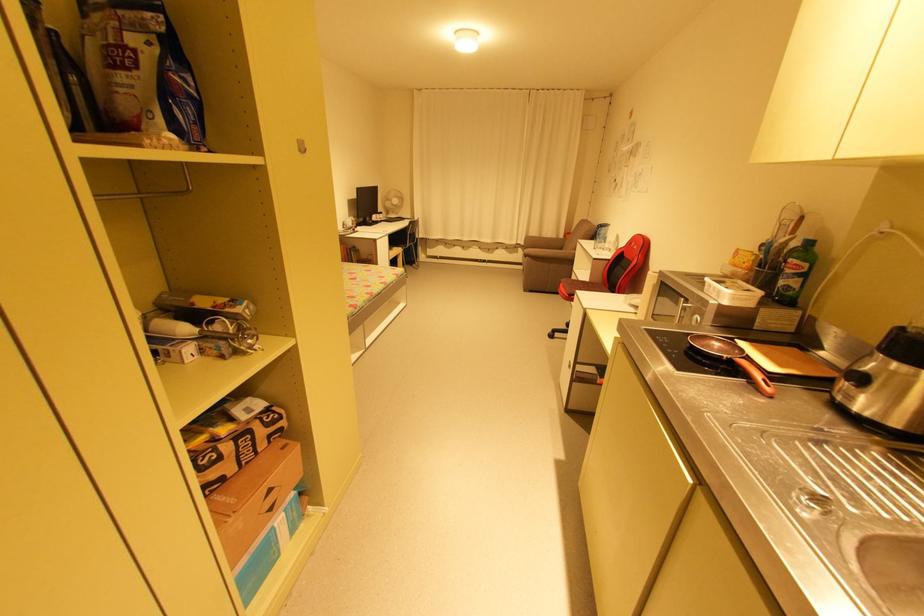
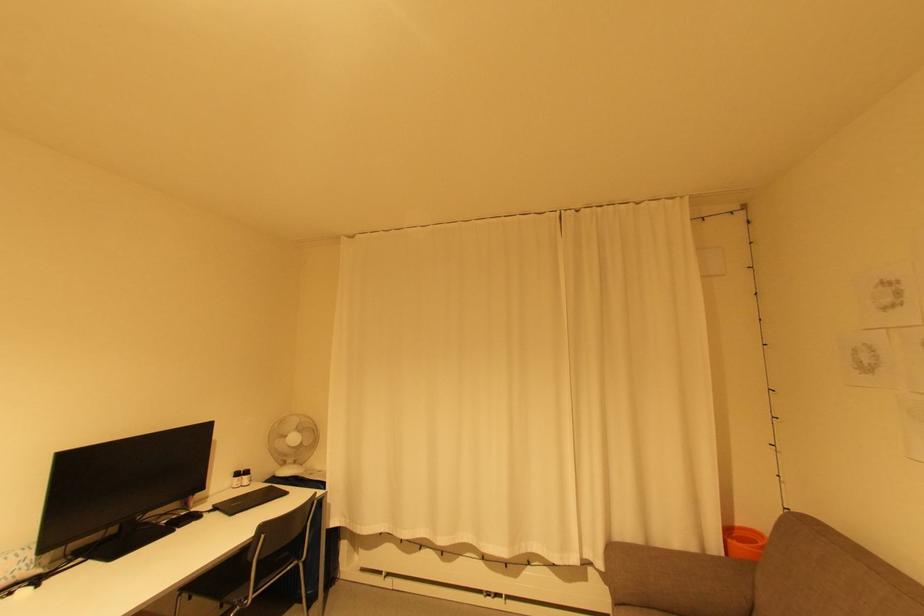
Where in the second image is the point corresponding to point (572, 233) from the first image?

(733, 533)